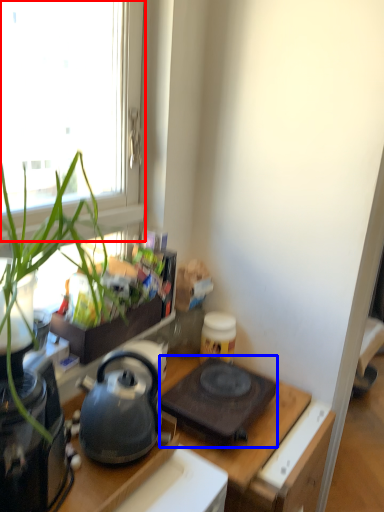
Question: Among these objects, which one is farthest to the camera, window (highlighted by a red box) or gas stove (highlighted by a blue box)?

Choices:
 (A) window
 (B) gas stove

Answer: (B)